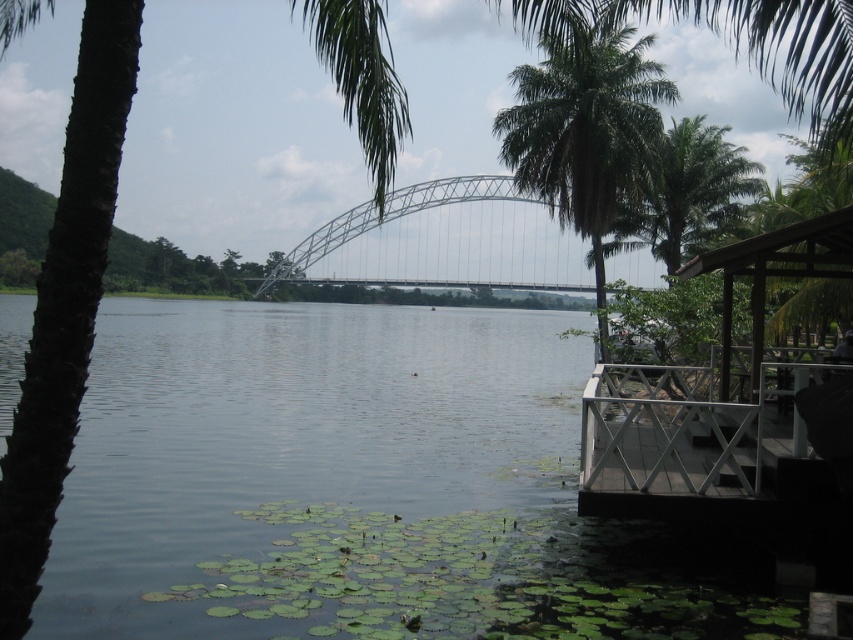
Question: Is white metal dock at lower right smaller than metallic gray bridge at center?

Choices:
 (A) yes
 (B) no

Answer: (A)

Question: Can you confirm if metallic gray bridge at center is positioned to the right of green leafy palm tree at upper center?

Choices:
 (A) no
 (B) yes

Answer: (B)

Question: Which of the following is the closest to the observer?

Choices:
 (A) white metal dock at lower right
 (B) metallic gray bridge at center
 (C) green leafy palm tree at upper center

Answer: (A)

Question: Among these objects, which one is farthest from the camera?

Choices:
 (A) green leafy palm tree at upper center
 (B) green leafy palm tree at upper right

Answer: (B)

Question: Is white metal dock at lower right smaller than green leafy palm tree at upper right?

Choices:
 (A) yes
 (B) no

Answer: (A)

Question: Among these objects, which one is nearest to the camera?

Choices:
 (A) green leafy palm tree at upper right
 (B) metallic gray bridge at center
 (C) white metal dock at lower right

Answer: (C)